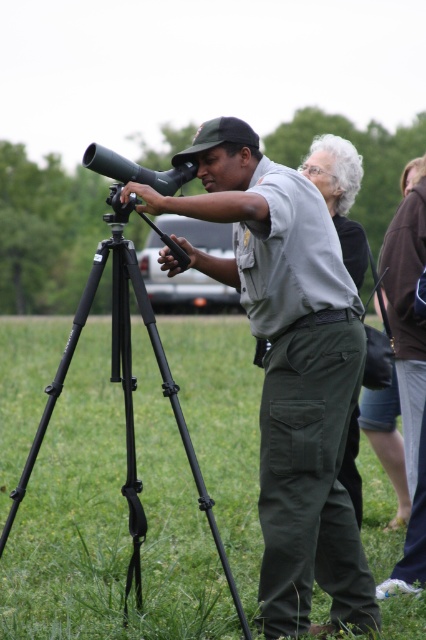
Question: Is matte gray uniform at center wider than black metal tripod at left?

Choices:
 (A) yes
 (B) no

Answer: (A)

Question: Is matte gray uniform at center smaller than black metal tripod at left?

Choices:
 (A) no
 (B) yes

Answer: (B)

Question: In this image, where is matte gray uniform at center located relative to black metal tripod at left?

Choices:
 (A) left
 (B) right

Answer: (B)

Question: Which of the following is the farthest from the observer?

Choices:
 (A) matte gray uniform at center
 (B) black metal tripod at left

Answer: (B)

Question: Which point is closer to the camera taking this photo?

Choices:
 (A) (23, 484)
 (B) (138, 189)

Answer: (B)